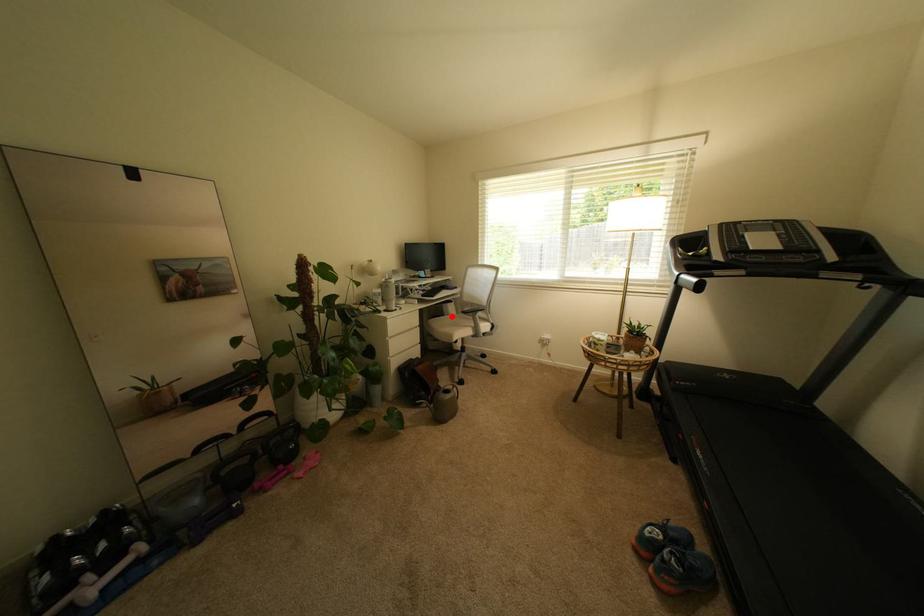
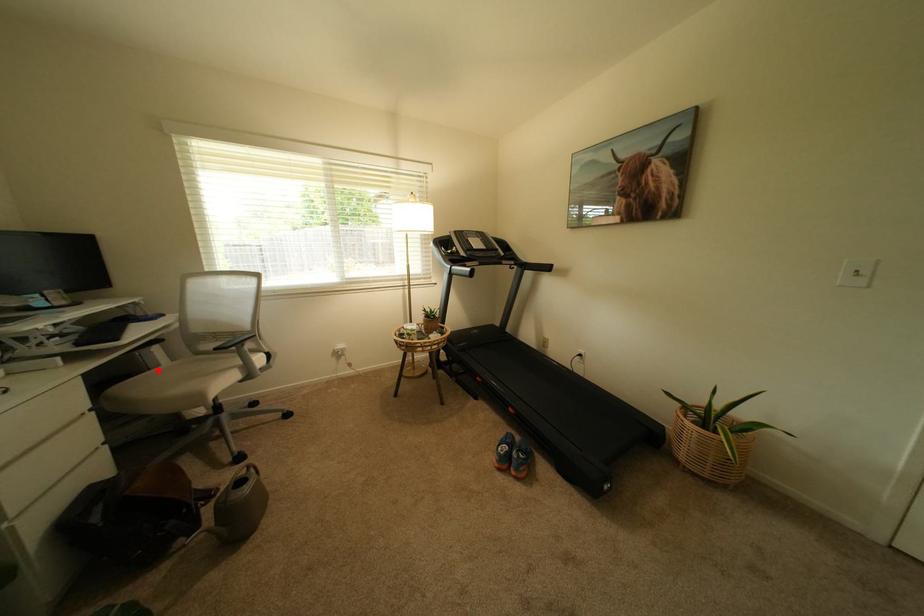
I am providing you with two images of the same scene from different viewpoints. A red point is marked on the first image and another point is marked on the second image. Is the red point in image1 aligned with the point shown in image2?

Yes